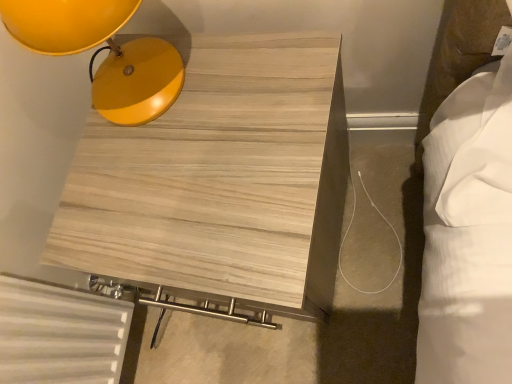
At what (x,y) coordinates should I click in order to perform the action: click on free space to the right of matte yellow lampshade at upper left. Please return your answer as a coordinate pair (x, y). The height and width of the screenshot is (384, 512). Looking at the image, I should click on (251, 58).